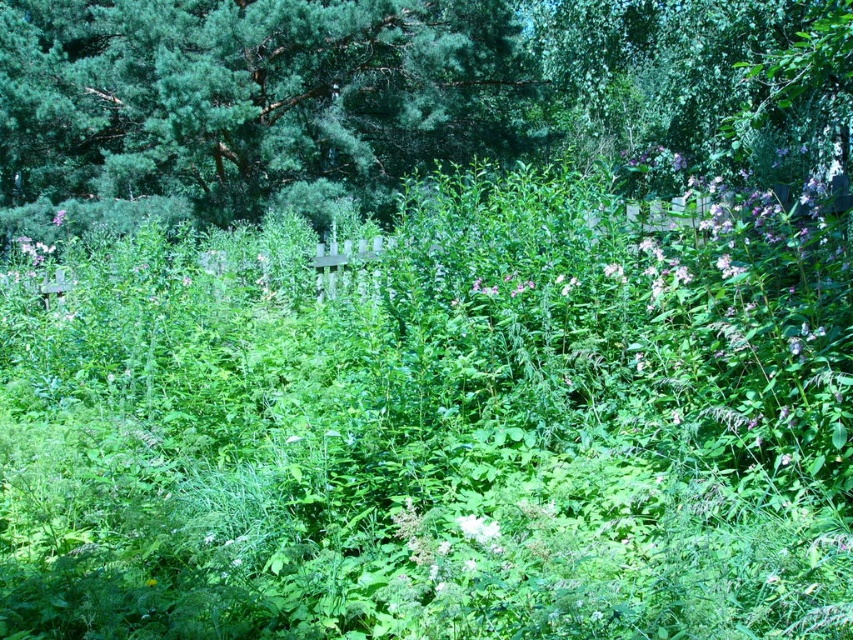
Question: Does green needle-like at upper center have a greater width compared to purple matte flower at upper left?

Choices:
 (A) yes
 (B) no

Answer: (A)

Question: Which point is farther to the camera?

Choices:
 (A) purple matte flower at upper left
 (B) pink matte flower at center

Answer: (A)

Question: Which point is farther to the camera?

Choices:
 (A) (27, 259)
 (B) (399, 65)

Answer: (B)

Question: Is pink matte flower at center smaller than purple matte flower at upper left?

Choices:
 (A) yes
 (B) no

Answer: (A)

Question: Among these objects, which one is farthest from the camera?

Choices:
 (A) green needle-like at upper center
 (B) pink matte flower at center
 (C) purple matte flower at upper left

Answer: (C)

Question: Does green needle-like at upper center appear over pink matte flower at center?

Choices:
 (A) yes
 (B) no

Answer: (A)